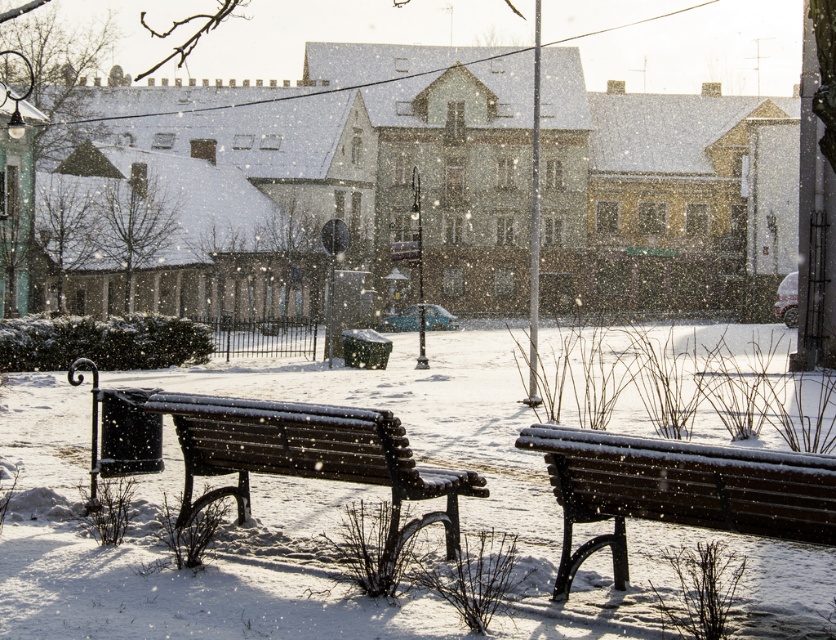
You are a snowplow operator who needs to clear the snow from the wooden bench at right and the wooden bench at center. Which bench should you clear first if you start from the left side of the square?

You should clear the wooden bench at center first since it is to the left of the wooden bench at right, so it is closer to your starting position on the left side of the square.

You are standing at the edge of the square facing the two wooden benches. Which bench, the wooden bench at right or the wooden bench at center, is closer to you?

The wooden bench at right is closer to you because it is in front of the wooden bench at center.

You are a snowplow operator who needs to clear snow from the town square. You have a small plow attachment that can only handle up to 1 meter in width. You see the wooden bench at right and the wooden bench at center. Which bench can you safely clear snow around without needing a larger plow?

The wooden bench at right has a smaller size compared to wooden bench at center. Therefore, the snowplow operator can safely clear snow around the wooden bench at right without needing a larger plow since it is narrower than the 1 meter width capacity.